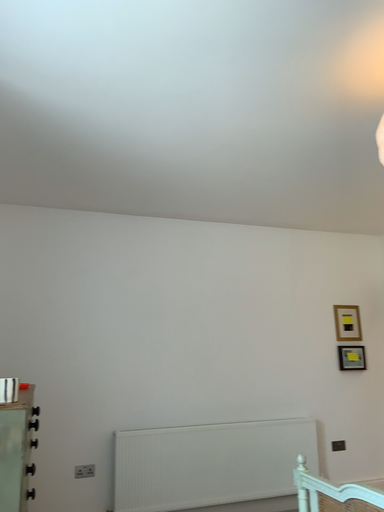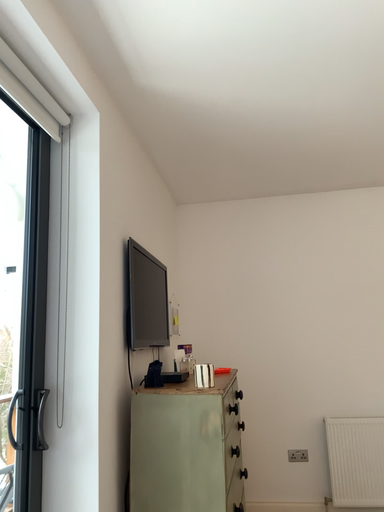
Question: How did the camera likely rotate when shooting the video?

Choices:
 (A) rotated right
 (B) rotated left

Answer: (B)